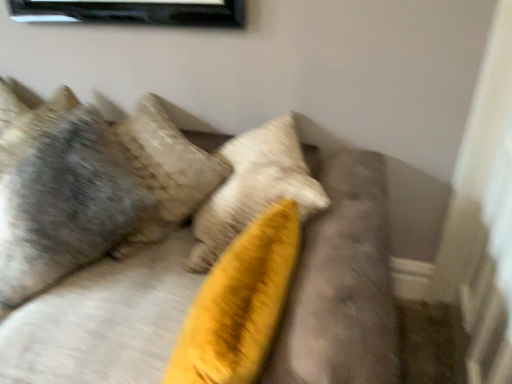
Question: Can you confirm if textured gray pillow at upper left is thinner than velvet yellow pillow at center?

Choices:
 (A) yes
 (B) no

Answer: (A)

Question: Can you confirm if textured gray pillow at upper left is bigger than velvet yellow pillow at center?

Choices:
 (A) no
 (B) yes

Answer: (A)

Question: Considering the relative sizes of textured gray pillow at upper left and velvet yellow pillow at center in the image provided, is textured gray pillow at upper left shorter than velvet yellow pillow at center?

Choices:
 (A) no
 (B) yes

Answer: (A)

Question: Could you tell me if textured gray pillow at upper left is facing velvet yellow pillow at center?

Choices:
 (A) yes
 (B) no

Answer: (A)

Question: Can you confirm if textured gray pillow at upper left is taller than velvet yellow pillow at center?

Choices:
 (A) yes
 (B) no

Answer: (A)

Question: Is textured gray pillow at upper left located outside velvet yellow pillow at center?

Choices:
 (A) yes
 (B) no

Answer: (B)

Question: Is the position of velvet yellow pillow at center more distant than that of textured gray pillow at upper left?

Choices:
 (A) yes
 (B) no

Answer: (B)

Question: From a real-world perspective, is velvet yellow pillow at center located higher than textured gray pillow at upper left?

Choices:
 (A) no
 (B) yes

Answer: (A)

Question: Does velvet yellow pillow at center have a greater width compared to textured gray pillow at upper left?

Choices:
 (A) no
 (B) yes

Answer: (B)

Question: Is velvet yellow pillow at center at the right side of textured gray pillow at upper left?

Choices:
 (A) no
 (B) yes

Answer: (B)

Question: From the image's perspective, does velvet yellow pillow at center appear higher than textured gray pillow at upper left?

Choices:
 (A) yes
 (B) no

Answer: (B)

Question: Is textured gray pillow at upper left inside velvet yellow pillow at center?

Choices:
 (A) no
 (B) yes

Answer: (B)

Question: Considering the positions of point (322, 344) and point (26, 261), is point (322, 344) closer or farther from the camera than point (26, 261)?

Choices:
 (A) farther
 (B) closer

Answer: (B)